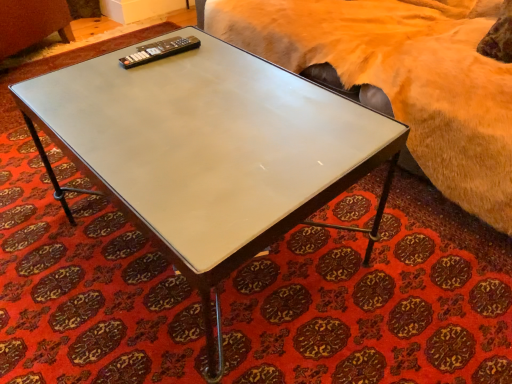
Question: From the image's perspective, does black plastic remote at upper left appear lower than white glossy coffee table at center?

Choices:
 (A) yes
 (B) no

Answer: (B)

Question: Does black plastic remote at upper left have a greater height compared to white glossy coffee table at center?

Choices:
 (A) no
 (B) yes

Answer: (A)

Question: Is black plastic remote at upper left further to the viewer compared to white glossy coffee table at center?

Choices:
 (A) no
 (B) yes

Answer: (B)

Question: Is black plastic remote at upper left outside white glossy coffee table at center?

Choices:
 (A) yes
 (B) no

Answer: (B)

Question: From the image's perspective, is black plastic remote at upper left above white glossy coffee table at center?

Choices:
 (A) no
 (B) yes

Answer: (B)

Question: Is point (143, 192) positioned closer to the camera than point (181, 43)?

Choices:
 (A) farther
 (B) closer

Answer: (B)

Question: In terms of height, does white glossy coffee table at center look taller or shorter compared to black plastic remote at upper left?

Choices:
 (A) short
 (B) tall

Answer: (B)

Question: In terms of width, does white glossy coffee table at center look wider or thinner when compared to black plastic remote at upper left?

Choices:
 (A) thin
 (B) wide

Answer: (B)

Question: Choose the correct answer: Is white glossy coffee table at center inside black plastic remote at upper left or outside it?

Choices:
 (A) inside
 (B) outside

Answer: (B)

Question: Is white glossy coffee table at center inside the boundaries of fuzzy beige bed at upper right, or outside?

Choices:
 (A) outside
 (B) inside

Answer: (A)

Question: Relative to fuzzy beige bed at upper right, is white glossy coffee table at center in front or behind?

Choices:
 (A) behind
 (B) front

Answer: (B)

Question: Is white glossy coffee table at center taller or shorter than fuzzy beige bed at upper right?

Choices:
 (A) short
 (B) tall

Answer: (A)

Question: Is white glossy coffee table at center to the left or to the right of fuzzy beige bed at upper right in the image?

Choices:
 (A) left
 (B) right

Answer: (A)

Question: Is point (173, 38) positioned closer to the camera than point (331, 226)?

Choices:
 (A) farther
 (B) closer

Answer: (B)

Question: Considering the positions of black plastic remote at upper left and white glossy coffee table at center in the image, is black plastic remote at upper left taller or shorter than white glossy coffee table at center?

Choices:
 (A) tall
 (B) short

Answer: (B)